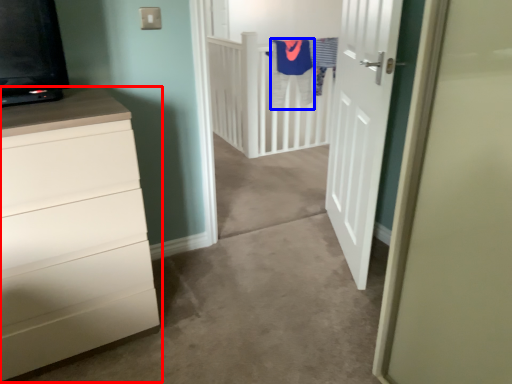
Question: Which of the following is the closest to the observer, chest of drawers (highlighted by a red box) or robe (highlighted by a blue box)?

Choices:
 (A) chest of drawers
 (B) robe

Answer: (A)